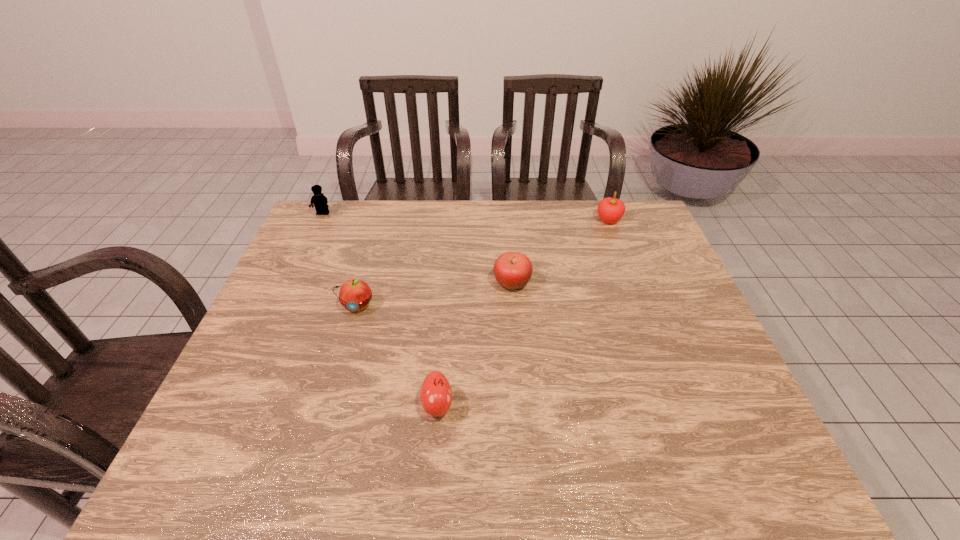
The height and width of the screenshot is (540, 960). I want to click on vacant space that satisfies the following two spatial constraints: 1. on the front-facing side of the farthest apple; 2. on the left side of the leftmost object, so pyautogui.click(x=320, y=220).

In order to click on vacant area that satisfies the following two spatial constraints: 1. on the front-facing side of the leftmost object; 2. on the left side of the rightmost object in this screenshot , I will do `click(320, 220)`.